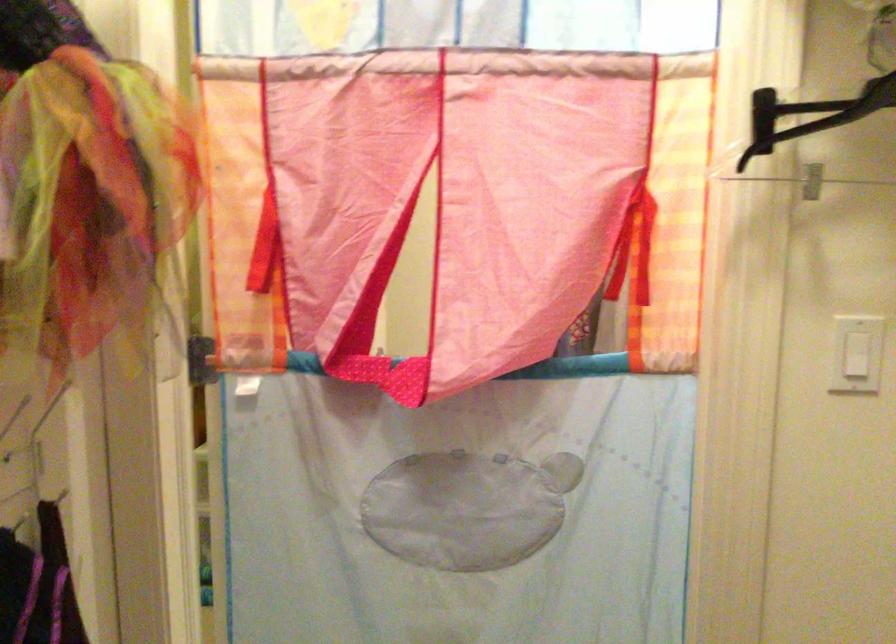
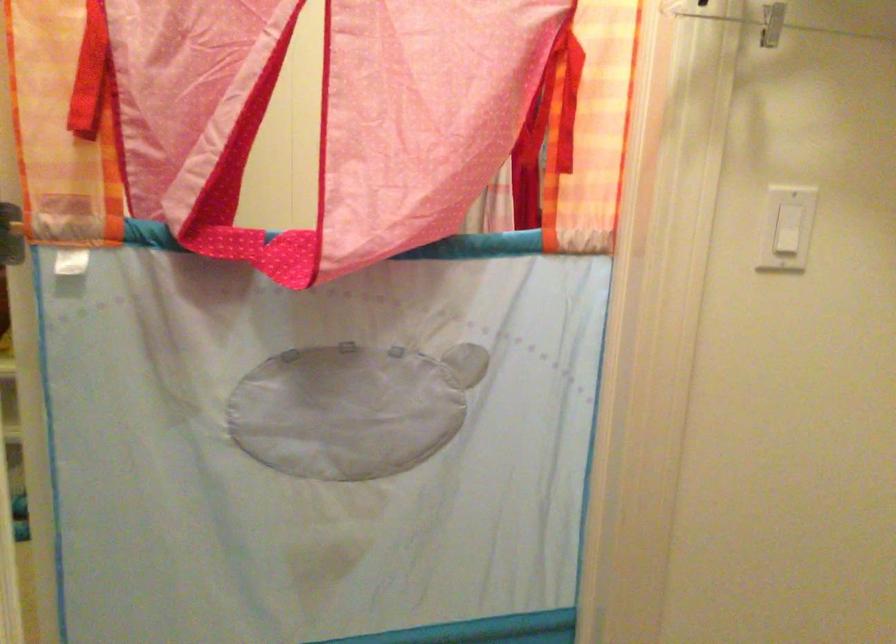
Question: The images are taken continuously from a first-person perspective. In which direction is your viewpoint rotating?

Choices:
 (A) Left
 (B) Right
 (C) Up
 (D) Down

Answer: (B)